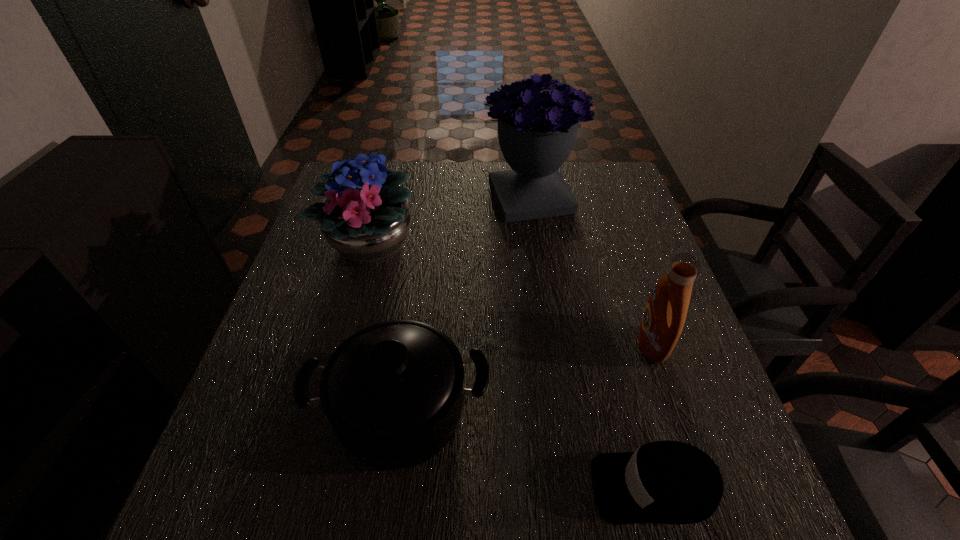
Where is `the tallest object`? the tallest object is located at coordinates (537, 130).

The image size is (960, 540). I want to click on the right bouquet, so click(x=537, y=130).

Find the location of a particular element. The width and height of the screenshot is (960, 540). detergent is located at coordinates (664, 316).

Find the location of a particular element. This screenshot has height=540, width=960. the shorter bouquet is located at coordinates (365, 217).

Find the location of a particular element. saucepan is located at coordinates (393, 392).

Image resolution: width=960 pixels, height=540 pixels. In order to click on cap in this screenshot , I will do `click(667, 482)`.

At what (x,y) coordinates should I click in order to perform the action: click on blank area located 0.310m on the left of the right bouquet. Please return your answer as a coordinate pair (x, y). Looking at the image, I should click on (379, 197).

Identify the location of free location located 0.080m on the front-facing side of the detergent. (601, 345).

Locate an element on the screen. The image size is (960, 540). free space located 0.220m on the front-facing side of the detergent is located at coordinates (535, 345).

Where is `free region located on the front-facing side of the detergent`? This screenshot has width=960, height=540. free region located on the front-facing side of the detergent is located at coordinates (549, 345).